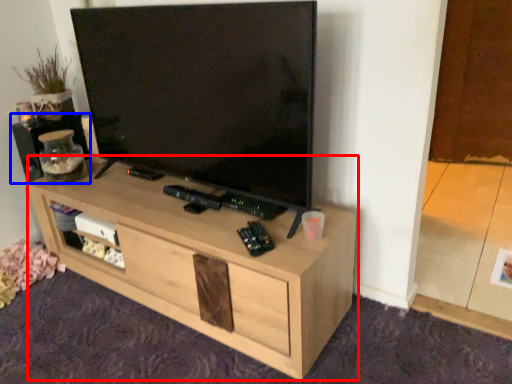
Question: Which object appears farthest to the camera in this image, desk (highlighted by a red box) or speaker (highlighted by a blue box)?

Choices:
 (A) desk
 (B) speaker

Answer: (B)